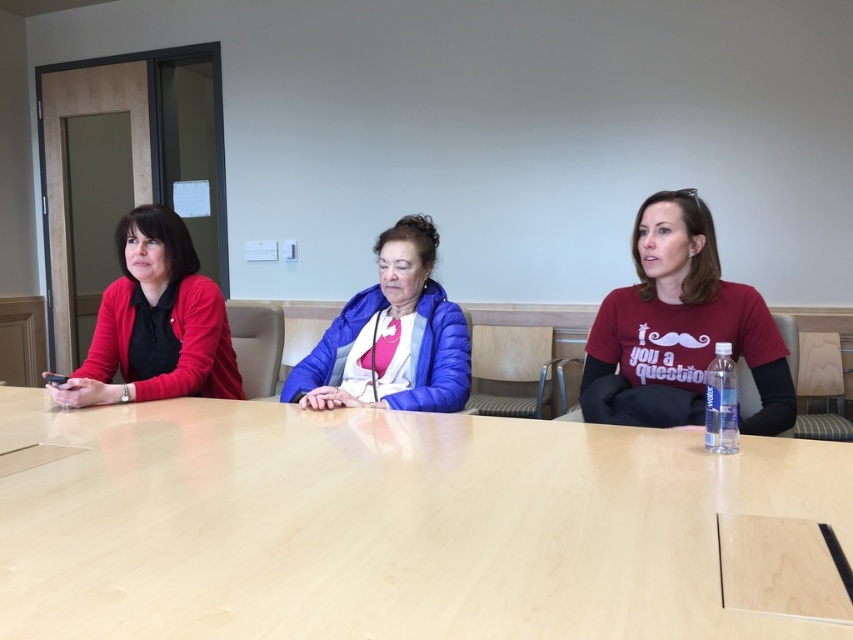
You are sitting at the light wood table at center and want to hand a document to the person wearing the matte red cardigan at left. Since you can only pass items across the table, will you need to reach to your left or right to give them the document?

Since the light wood table at center is to the right of the matte red cardigan at left, you would need to reach to your left to give the document to the person wearing the matte red cardigan at left.

Where is the light wood table at center located in the image?

The light wood table at center is located at point [384,524] in the image.

You are standing in the conference room and want to reach a point marked at coordinates (686, 298). If you are currently 2 meters away from this point, can you take a step forward to reach it?

The distance of point (686, 298) from viewer is 1.84 meters, so you are already closer than 2 meters. Therefore, you don not need to move forward to reach it.